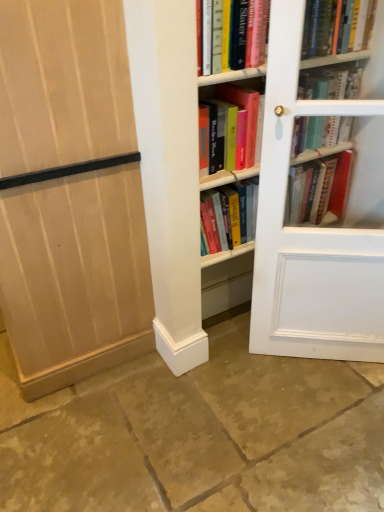
Identify the location of hardcover book at upper center, the 1th book from the left. This screenshot has height=512, width=384. (233, 35).

What do you see at coordinates (335, 26) in the screenshot? The height and width of the screenshot is (512, 384). I see `hardcover book at upper right, placed as the second book when sorted from left to right` at bounding box center [335, 26].

This screenshot has height=512, width=384. What do you see at coordinates (198, 435) in the screenshot?
I see `brown stone floor at lower center` at bounding box center [198, 435].

Find the location of `hardcover book at upper center, positioned as the third book in right-to-left order`. hardcover book at upper center, positioned as the third book in right-to-left order is located at coordinates pos(233,35).

Looking at the image, does hardcover book at upper center, positioned as the third book in right-to-left order, seem bigger or smaller compared to hardcover book at upper right, which appears as the second book when viewed from the right?

hardcover book at upper center, positioned as the third book in right-to-left order, is bigger than hardcover book at upper right, which appears as the second book when viewed from the right.

Can you confirm if hardcover book at upper center, the 1th book from the left, is thinner than hardcover book at upper right, which appears as the second book when viewed from the right?

In fact, hardcover book at upper center, the 1th book from the left, might be wider than hardcover book at upper right, which appears as the second book when viewed from the right.

How far apart are hardcover book at upper center, the 1th book from the left, and hardcover book at upper right, placed as the second book when sorted from left to right?

hardcover book at upper center, the 1th book from the left, and hardcover book at upper right, placed as the second book when sorted from left to right, are 11.97 inches apart from each other.

Considering their positions, is hardcover book at center, placed as the 3th book when sorted from left to right, located in front of or behind brown stone floor at lower center?

Clearly, hardcover book at center, placed as the 3th book when sorted from left to right, is behind brown stone floor at lower center.

Would you consider hardcover book at center, which appears as the first book when viewed from the right, to be distant from brown stone floor at lower center?

Yes.

Which is less distant, (340,85) or (276,361)?

The point (340,85) is in front.

Between hardcover book at center, which appears as the first book when viewed from the right, and hardcover book at upper center, the 1th book from the left, which one has smaller width?

hardcover book at center, which appears as the first book when viewed from the right.

Is hardcover book at center, which appears as the first book when viewed from the right, oriented away from hardcover book at upper center, the 1th book from the left?

No, hardcover book at center, which appears as the first book when viewed from the right, is not facing the opposite direction of hardcover book at upper center, the 1th book from the left.

Is hardcover book at center, which appears as the first book when viewed from the right, further to camera compared to hardcover book at upper center, positioned as the third book in right-to-left order?

Yes, hardcover book at center, which appears as the first book when viewed from the right, is further from the camera.

From a real-world perspective, is hardcover book at center, which appears as the first book when viewed from the right, located higher than hardcover book at upper center, positioned as the third book in right-to-left order?

No, from a real-world perspective, hardcover book at center, which appears as the first book when viewed from the right, is not on top of hardcover book at upper center, positioned as the third book in right-to-left order.

The height and width of the screenshot is (512, 384). What are the coordinates of `concrete in front of the light wood paneling at left` in the screenshot? It's located at (198, 435).

Does brown stone floor at lower center turn towards light wood paneling at left?

No, brown stone floor at lower center is not turned towards light wood paneling at left.

Are brown stone floor at lower center and light wood paneling at left beside each other?

No, brown stone floor at lower center is not beside light wood paneling at left.

Consider the image. Visually, is brown stone floor at lower center positioned to the left or to the right of light wood paneling at left?

brown stone floor at lower center is positioned on light wood paneling at left's right side.

Does hardcover book at upper right, placed as the second book when sorted from left to right, have a lesser width compared to white glass door at right?

No, hardcover book at upper right, placed as the second book when sorted from left to right, is not thinner than white glass door at right.

Between hardcover book at upper right, which appears as the second book when viewed from the right, and white glass door at right, which one has smaller size?

hardcover book at upper right, which appears as the second book when viewed from the right.

You are a GUI agent. You are given a task and a screenshot of the screen. Output one action in this format:
    pyautogui.click(x=<x>, y=<y>)
    Task: Click on the bookcase in front of the hardcover book at upper right, placed as the second book when sorted from left to right
    Image resolution: width=384 pixels, height=512 pixels.
    Given the screenshot: What is the action you would take?
    pyautogui.click(x=316, y=225)

From a real-world perspective, who is located lower, hardcover book at upper right, which appears as the second book when viewed from the right, or white glass door at right?

white glass door at right, from a real-world perspective.

Are brown stone floor at lower center and hardcover book at center, placed as the 3th book when sorted from left to right, far apart?

Yes, brown stone floor at lower center and hardcover book at center, placed as the 3th book when sorted from left to right, are located far from each other.

From their relative heights in the image, would you say brown stone floor at lower center is taller or shorter than hardcover book at center, which appears as the first book when viewed from the right?

Considering their sizes, brown stone floor at lower center has less height than hardcover book at center, which appears as the first book when viewed from the right.

Is brown stone floor at lower center thinner than hardcover book at center, placed as the 3th book when sorted from left to right?

No.

Which is behind, point (276, 382) or point (335, 143)?

Point (276, 382)

Is the position of white glass door at right more distant than that of light wood paneling at left?

Yes, it is.

From the image's perspective, is white glass door at right located above or below light wood paneling at left?

white glass door at right is below light wood paneling at left.

Based on the photo, how many degrees apart are the facing directions of white glass door at right and light wood paneling at left?

53.4 degrees separate the facing orientations of white glass door at right and light wood paneling at left.

Based on their sizes in the image, would you say white glass door at right is bigger or smaller than light wood paneling at left?

Clearly, white glass door at right is smaller in size than light wood paneling at left.

The width and height of the screenshot is (384, 512). I want to click on the 1st book below when counting from the hardcover book at upper right, which appears as the second book when viewed from the right (from the image's perspective), so click(233, 35).

Starting from the brown stone floor at lower center, which book is the 3rd one behind? Please provide its 2D coordinates.

[(319, 132)]

Which object lies nearer to the anchor point hardcover book at upper center, positioned as the third book in right-to-left order, hardcover book at upper right, placed as the second book when sorted from left to right, or white glass door at right?

Among the two, hardcover book at upper right, placed as the second book when sorted from left to right, is located nearer to hardcover book at upper center, positioned as the third book in right-to-left order.

Looking at the image, which one is located further to hardcover book at upper right, placed as the second book when sorted from left to right, light wood paneling at left or hardcover book at center, which appears as the first book when viewed from the right?

light wood paneling at left is positioned further to the anchor hardcover book at upper right, placed as the second book when sorted from left to right.

In the scene shown: From the image, which object appears to be farther from hardcover book at center, which appears as the first book when viewed from the right, hardcover book at upper center, the 1th book from the left, or hardcover book at upper right, placed as the second book when sorted from left to right?

hardcover book at upper center, the 1th book from the left, lies further to hardcover book at center, which appears as the first book when viewed from the right, than the other object.

From the image, which object appears to be nearer to hardcover book at upper right, which appears as the second book when viewed from the right, white glass door at right or hardcover book at center, placed as the 3th book when sorted from left to right?

hardcover book at center, placed as the 3th book when sorted from left to right, lies closer to hardcover book at upper right, which appears as the second book when viewed from the right, than the other object.

Looking at the image, which one is located further to white glass door at right, hardcover book at center, placed as the 3th book when sorted from left to right, or hardcover book at upper center, the 1th book from the left?

hardcover book at center, placed as the 3th book when sorted from left to right, lies further to white glass door at right than the other object.

From the image, which object appears to be farther from hardcover book at center, placed as the 3th book when sorted from left to right, brown stone floor at lower center or hardcover book at upper center, the 1th book from the left?

brown stone floor at lower center is positioned further to the anchor hardcover book at center, placed as the 3th book when sorted from left to right.

Based on their spatial positions, is light wood paneling at left or hardcover book at center, which appears as the first book when viewed from the right, closer to hardcover book at upper center, the 1th book from the left?

Among the two, hardcover book at center, which appears as the first book when viewed from the right, is located nearer to hardcover book at upper center, the 1th book from the left.

Based on their spatial positions, is white glass door at right or hardcover book at upper center, the 1th book from the left, closer to hardcover book at center, placed as the 3th book when sorted from left to right?

hardcover book at upper center, the 1th book from the left, lies closer to hardcover book at center, placed as the 3th book when sorted from left to right, than the other object.

Locate an element on the screen. The image size is (384, 512). door between hardcover book at upper center, the 1th book from the left, and brown stone floor at lower center, in the vertical direction is located at coordinates (75, 276).

Where is `book between hardcover book at upper center, positioned as the third book in right-to-left order, and brown stone floor at lower center vertically`? book between hardcover book at upper center, positioned as the third book in right-to-left order, and brown stone floor at lower center vertically is located at coordinates (319, 132).

Where is `concrete located between light wood paneling at left and white glass door at right in the left-right direction`? This screenshot has height=512, width=384. concrete located between light wood paneling at left and white glass door at right in the left-right direction is located at coordinates click(x=198, y=435).

At what (x,y) coordinates should I click in order to perform the action: click on concrete situated between light wood paneling at left and hardcover book at center, which appears as the first book when viewed from the right, from left to right. Please return your answer as a coordinate pair (x, y). Looking at the image, I should click on (198, 435).